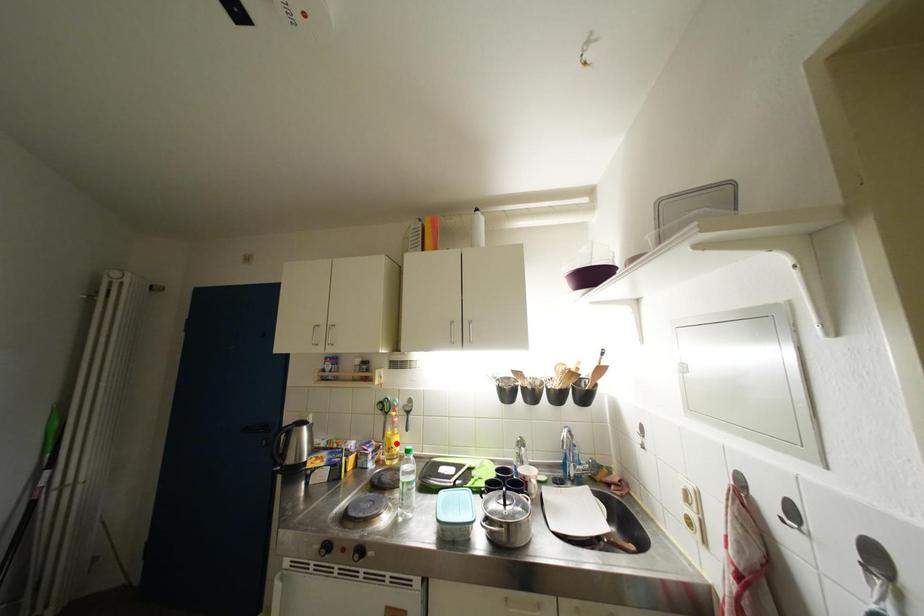
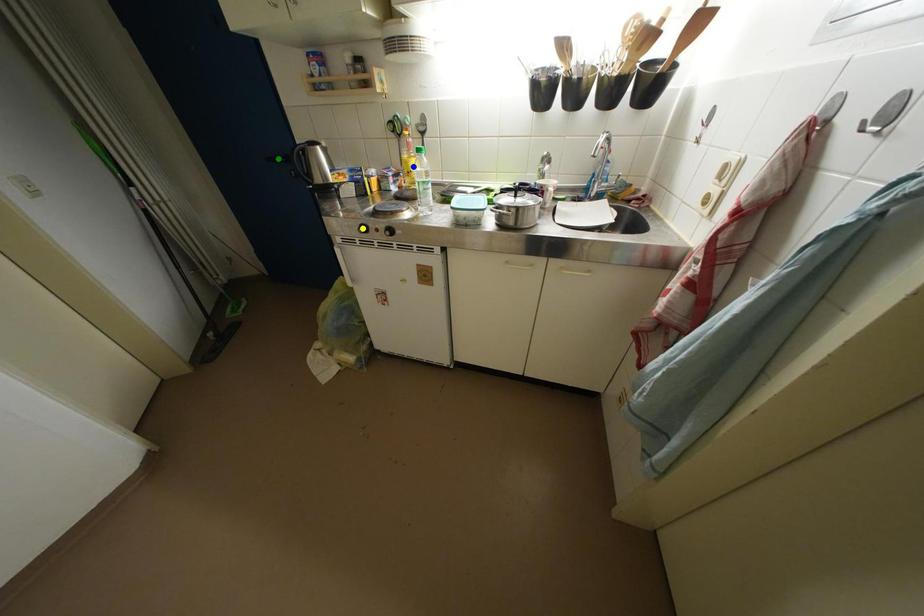
Question: I am providing you with two images of the same scene from different viewpoints. A red point is marked on the first image. You are given multiple points on the second image. Which point in image 2 is actually the same real-world point as the red point in image 1?

Choices:
 (A) yellow point
 (B) blue point
 (C) green point

Answer: (B)